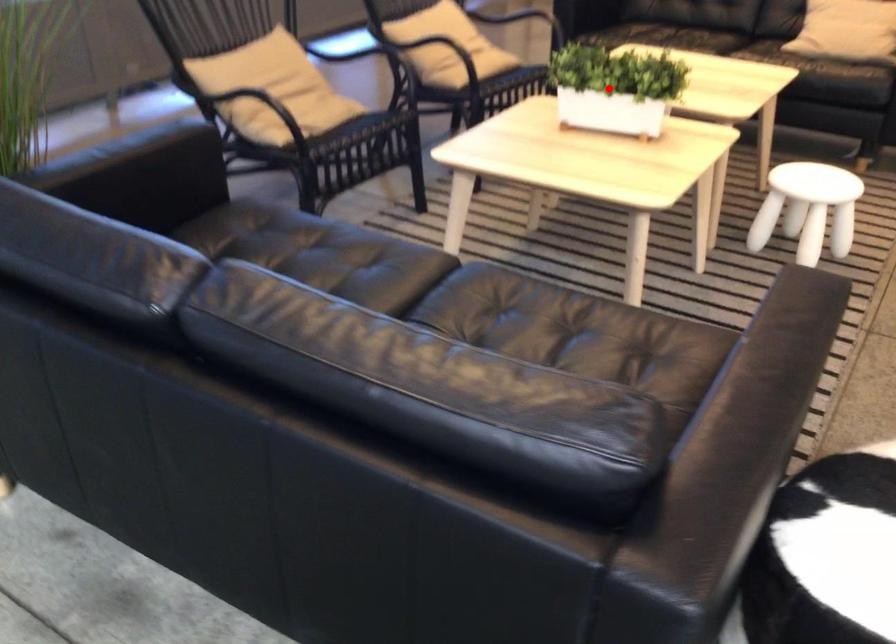
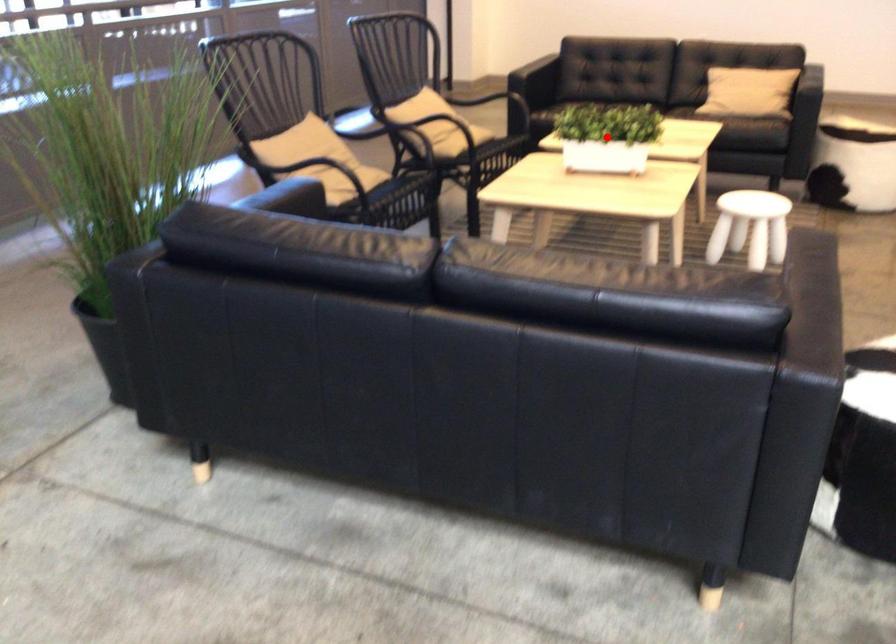
I am providing you with two images of the same scene from different viewpoints. A red point is marked on the first image and another point is marked on the second image. Do the highlighted points in image1 and image2 indicate the same real-world spot?

Yes